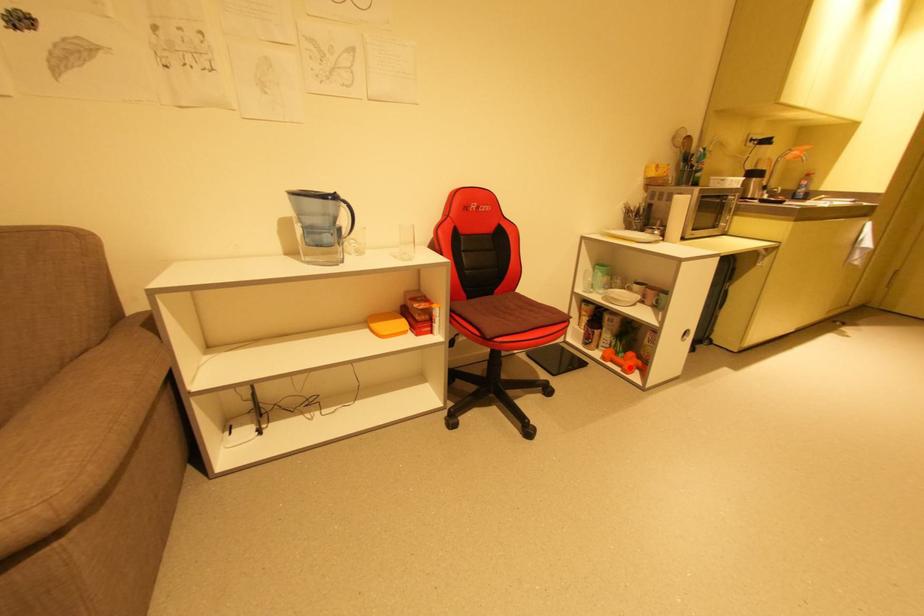
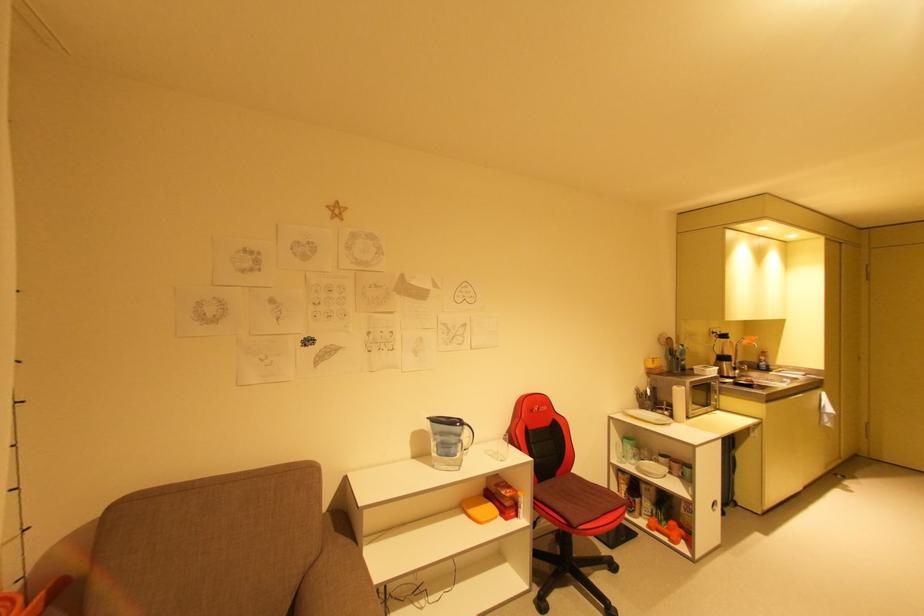
In the second image, find the point that corresponds to the highlighted location in the first image.

(675, 538)